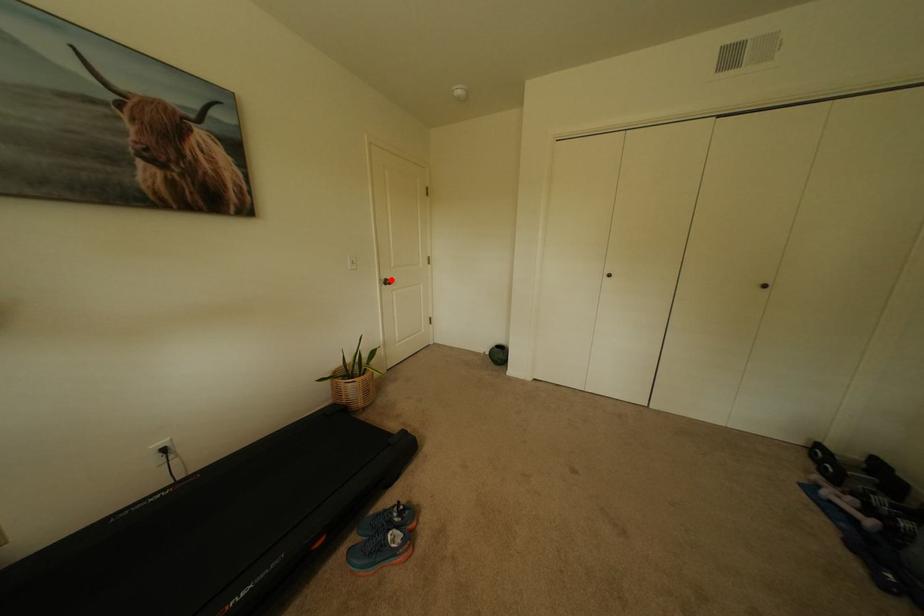
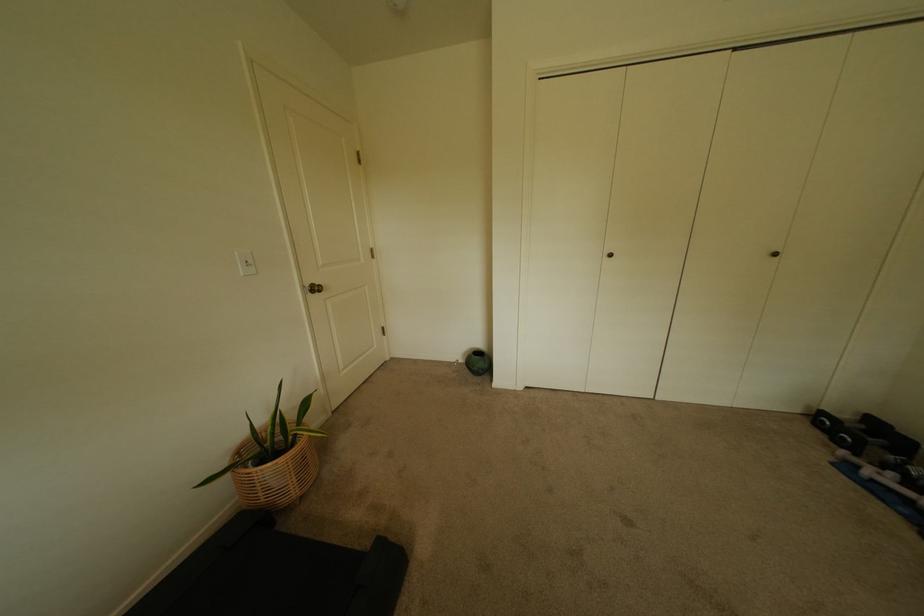
Where in the second image is the point corresponding to the highlighted location from the first image?

(315, 286)